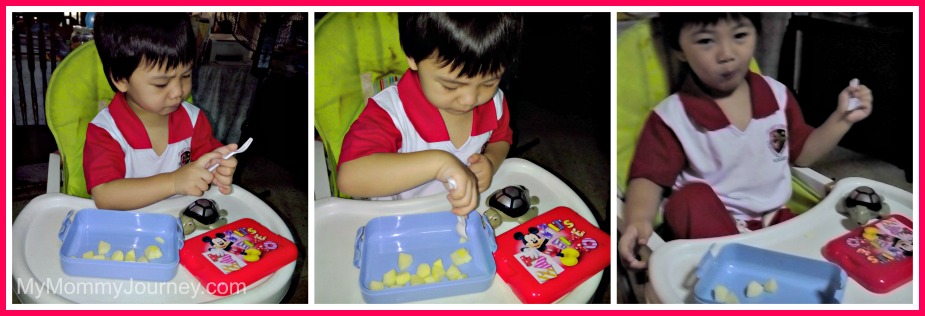
Where is `high chair`? Image resolution: width=925 pixels, height=316 pixels. high chair is located at coordinates (79, 97).